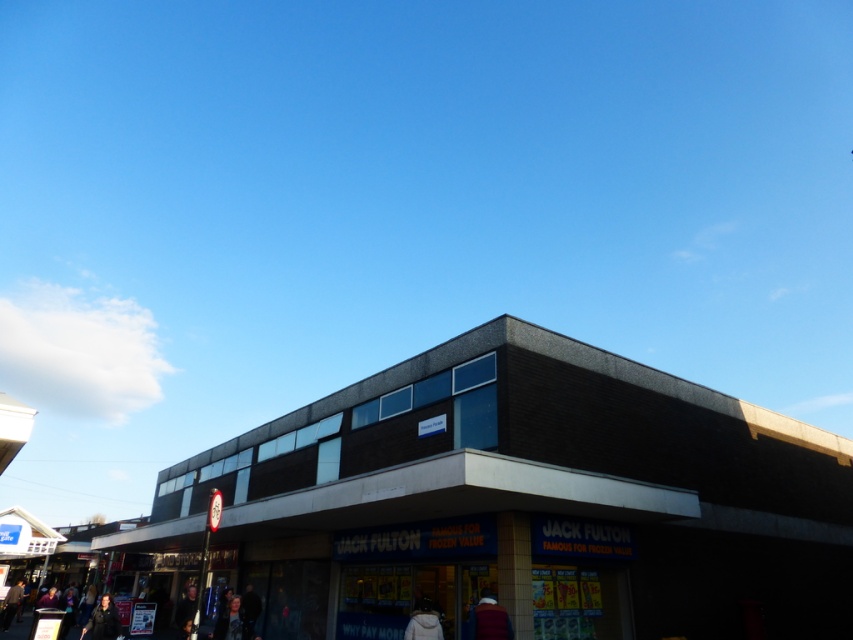
Question: Which is farther from the dark blue leather jacket at lower left?

Choices:
 (A) velvet-like burgundy coat at lower center
 (B) white fabric jacket at lower center

Answer: (A)

Question: In this image, where is dark gray concrete jack fulton store at center located relative to velvet-like burgundy coat at lower center?

Choices:
 (A) left
 (B) right

Answer: (A)

Question: Which object appears farthest from the camera in this image?

Choices:
 (A) velvet-like burgundy coat at lower center
 (B) dark blue leather jacket at lower left
 (C) dark gray concrete jack fulton store at center
 (D) white fabric jacket at lower center

Answer: (B)

Question: Can you confirm if dark blue leather jacket at lower left is positioned to the right of white fabric jacket at lower center?

Choices:
 (A) yes
 (B) no

Answer: (B)

Question: Which object is farther from the camera taking this photo?

Choices:
 (A) white fabric jacket at lower center
 (B) dark blue leather jacket at lower left
 (C) velvet-like burgundy coat at lower center

Answer: (B)

Question: In this image, where is dark gray concrete jack fulton store at center located relative to white fabric jacket at lower center?

Choices:
 (A) above
 (B) below

Answer: (B)